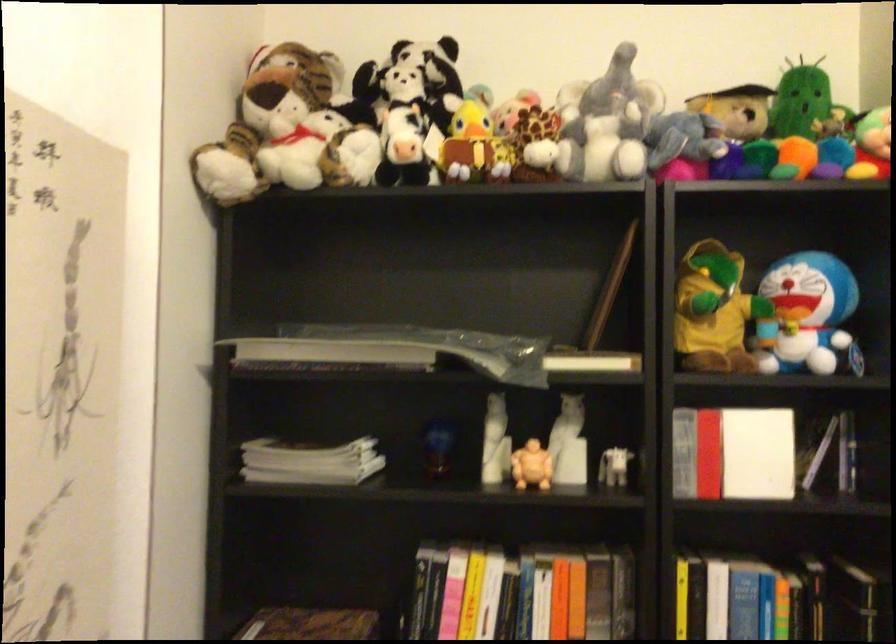
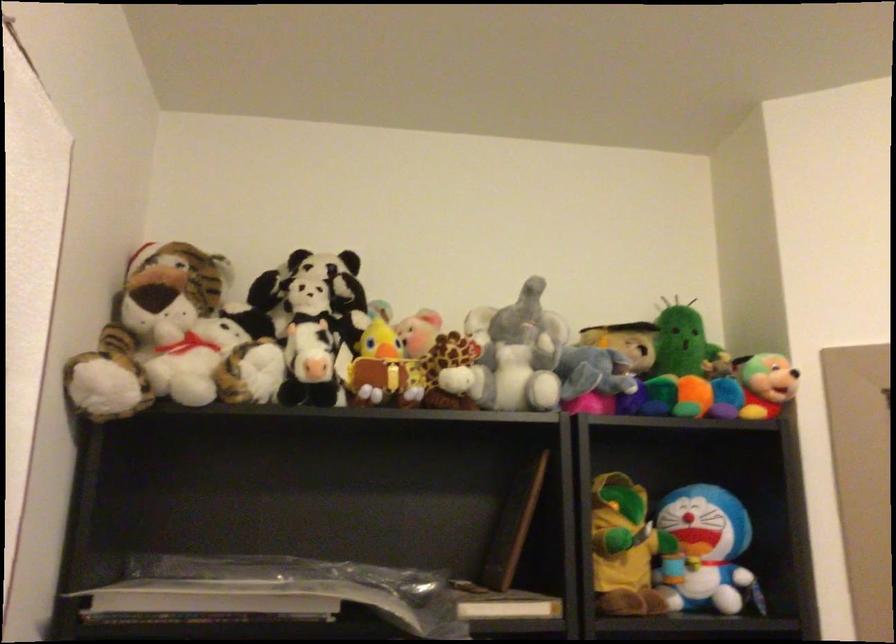
Which direction would the cameraman need to move to produce the second image?

The cameraman moved toward left, forward.